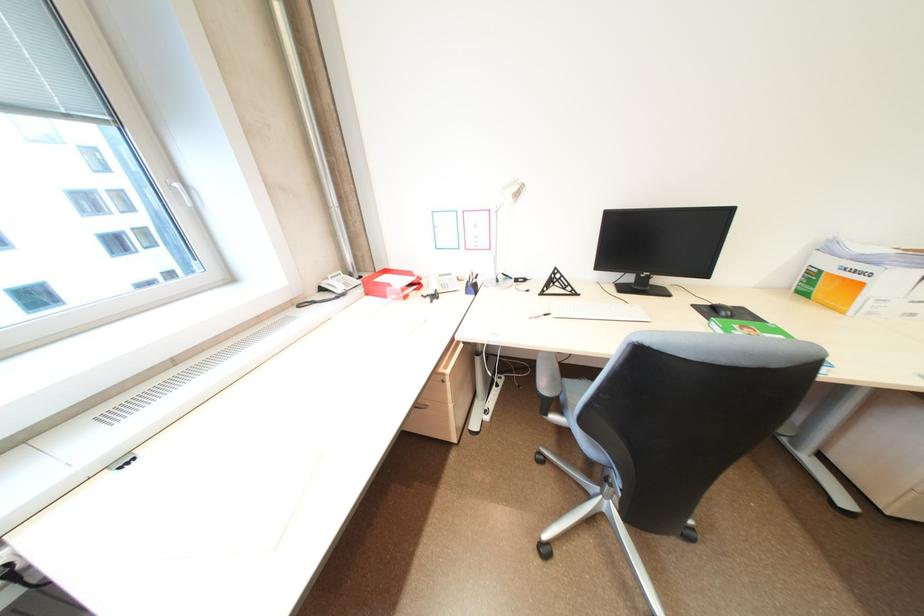
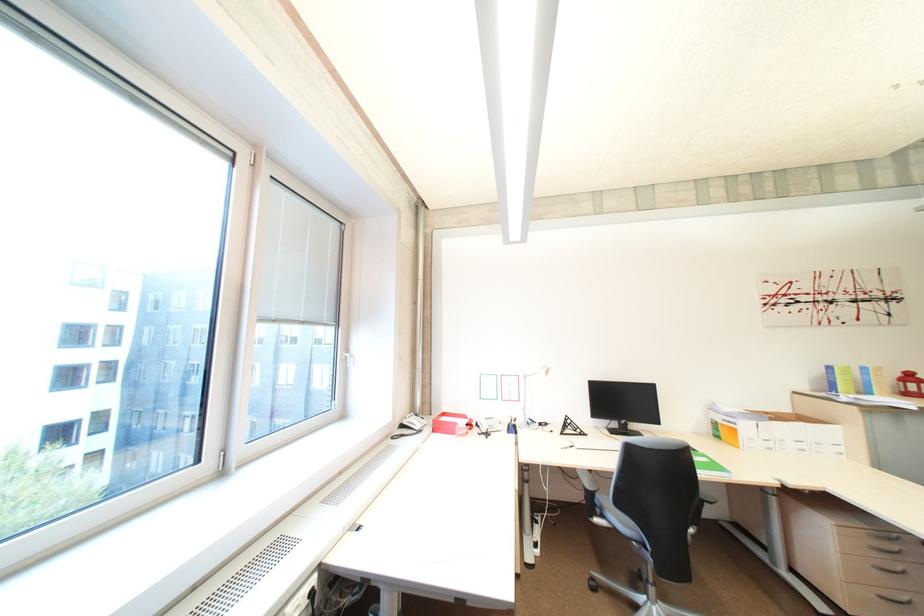
Locate, in the second image, the point that corresponds to (553,386) in the first image.

(598, 485)